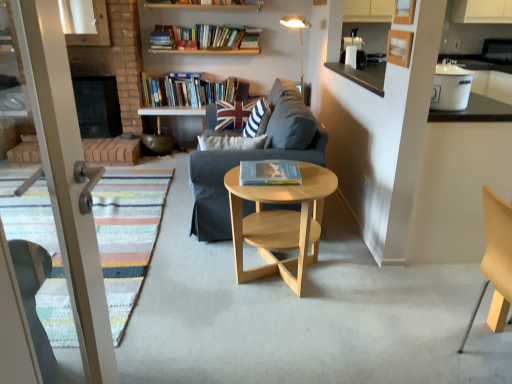
You are a GUI agent. You are given a task and a screenshot of the screen. Output one action in this format:
    pyautogui.click(x=<x>, y=<y>)
    Task: Click on the free space on the front side of natural wood coffee table at center
    The height and width of the screenshot is (384, 512).
    Given the screenshot: What is the action you would take?
    pyautogui.click(x=284, y=341)